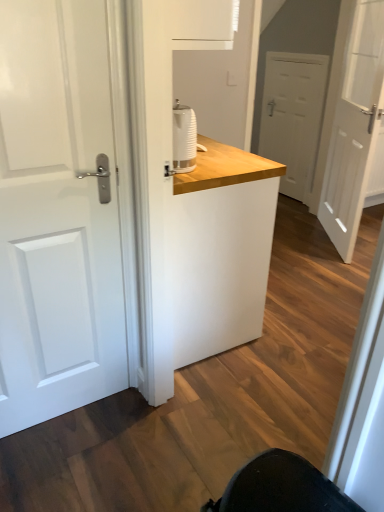
Question: In the image, is white matte door at right, which ranks as the 2th door in back-to-front order, positioned in front of or behind white glossy door at left, which is the 3th door from back to front?

Choices:
 (A) front
 (B) behind

Answer: (B)

Question: From a real-world perspective, is white matte door at right, the second door viewed from the front, physically located above or below white glossy door at left, which is the 3th door from back to front?

Choices:
 (A) below
 (B) above

Answer: (B)

Question: Based on their relative distances, which object is nearer to the white wood counter at center?

Choices:
 (A) white matte door at center, which is the 2th door from right to left
 (B) white glossy door at left, which is the 3th door from back to front
 (C) white matte door at right, the second door viewed from the front

Answer: (B)

Question: Which is nearer to the white glossy door at left, which is the 3th door from back to front?

Choices:
 (A) white matte door at center, the 2th door in the left-to-right sequence
 (B) white matte door at right, arranged as the first door when viewed from the right
 (C) white wood counter at center

Answer: (C)